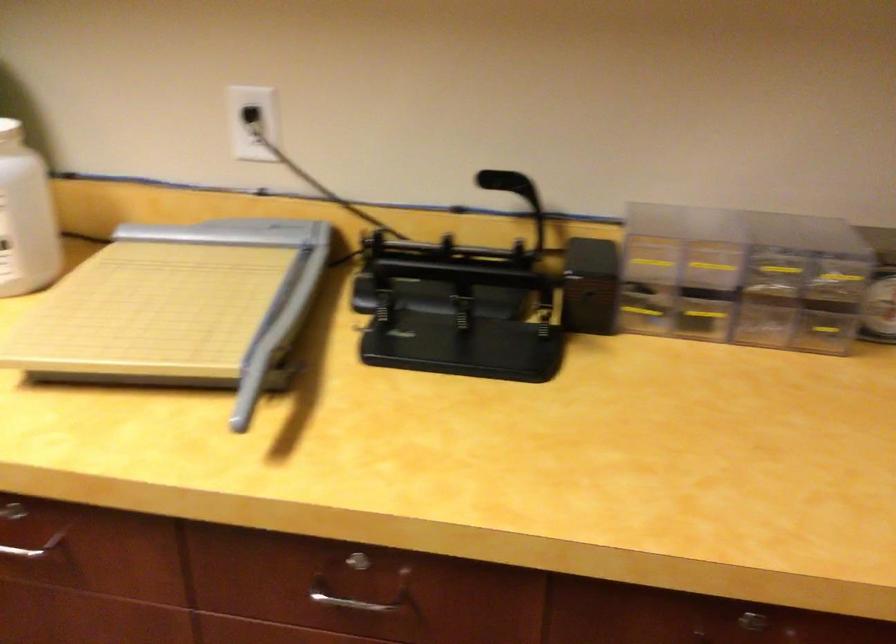
Find where to push the black hole punch lever. Please return your answer as a coordinate pair (x, y).

(494, 180)